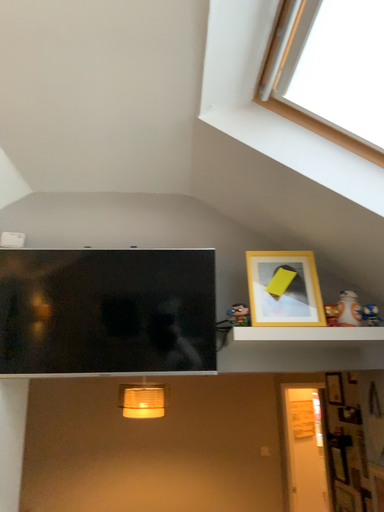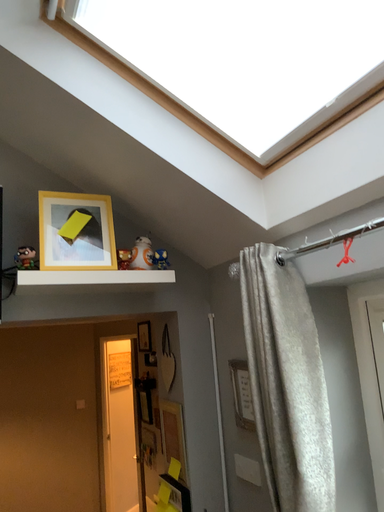
Question: How did the camera likely rotate when shooting the video?

Choices:
 (A) rotated right
 (B) rotated left

Answer: (A)